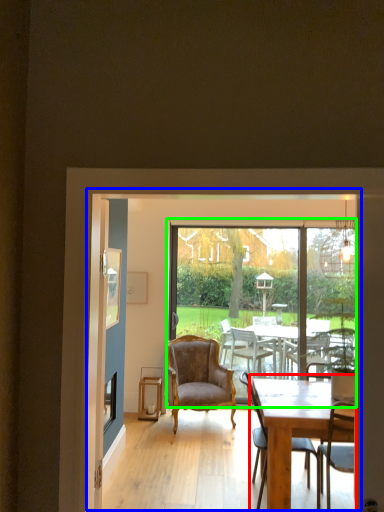
Question: Estimate the real-world distances between objects in this image. Which object is farther from round table (highlighted by a red box), screen door (highlighted by a blue box) or window screen (highlighted by a green box)?

Choices:
 (A) screen door
 (B) window screen

Answer: (B)